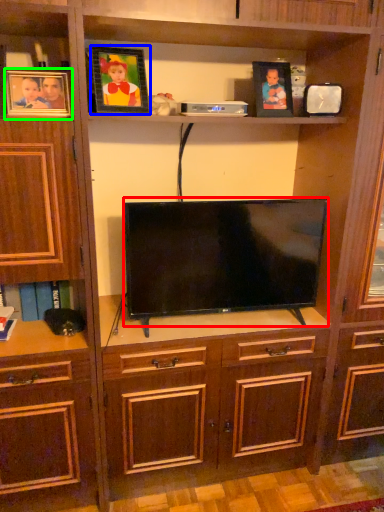
Question: Considering the real-world distances, which object is farthest from television (highlighted by a red box)? picture frame (highlighted by a blue box) or picture frame (highlighted by a green box)?

Choices:
 (A) picture frame
 (B) picture frame

Answer: (B)